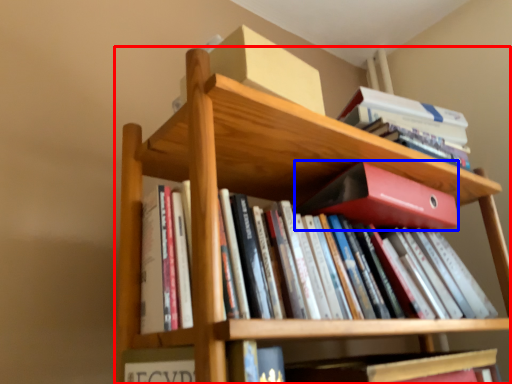
Question: Which object is closer to the camera taking this photo, bookcase (highlighted by a red box) or paperback book (highlighted by a blue box)?

Choices:
 (A) bookcase
 (B) paperback book

Answer: (A)